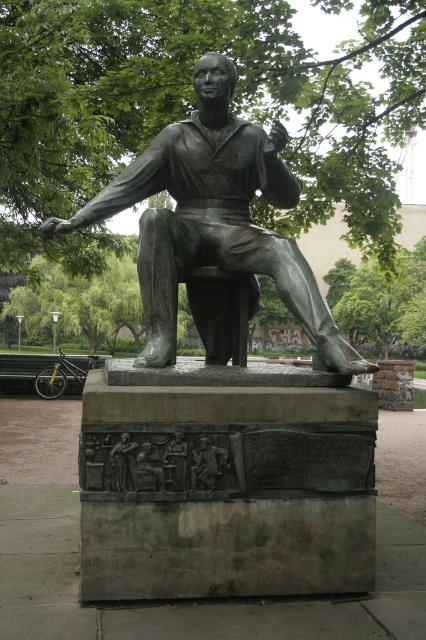
Which is below, bronze statue at center or bronze relief figure at center?

Positioned lower is bronze relief figure at center.

Is point (212, 227) positioned before point (118, 445)?

No, (212, 227) is further to viewer.

This screenshot has height=640, width=426. I want to click on bronze statue at center, so click(215, 218).

Does bronze relief figure at lower center have a smaller size compared to bronze relief figure at center?

Yes.

Who is more distant from viewer, (192, 490) or (115, 461)?

Positioned behind is point (192, 490).

Identify the location of bronze relief figure at lower center. (207, 464).

Does bronze statue at center have a smaller size compared to bronze relief figure at lower center?

No.

Is bronze statue at center thinner than bronze relief figure at lower center?

No, bronze statue at center is not thinner than bronze relief figure at lower center.

Locate an element on the screen. The height and width of the screenshot is (640, 426). bronze statue at center is located at coordinates (215, 218).

Locate an element on the screen. This screenshot has width=426, height=640. bronze statue at center is located at coordinates (215, 218).